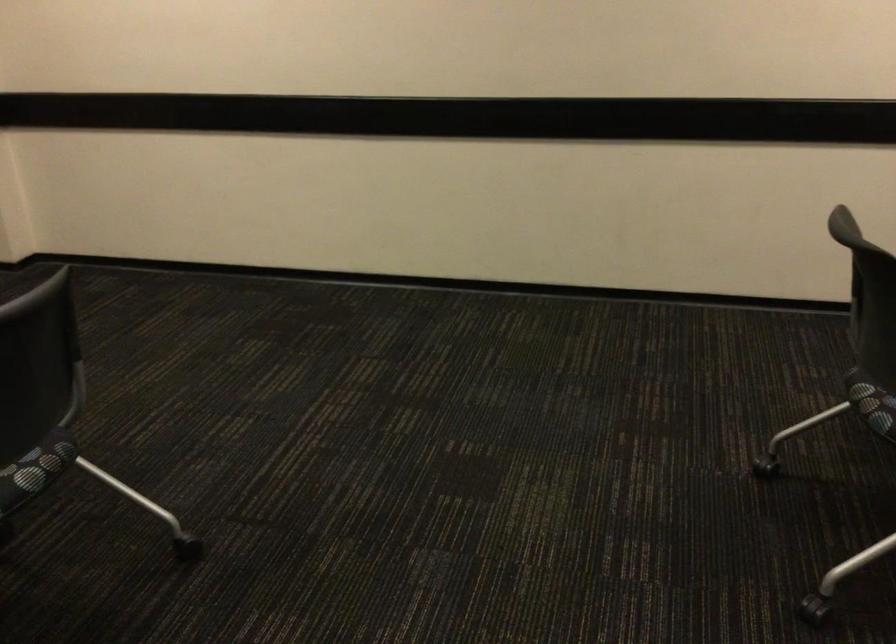
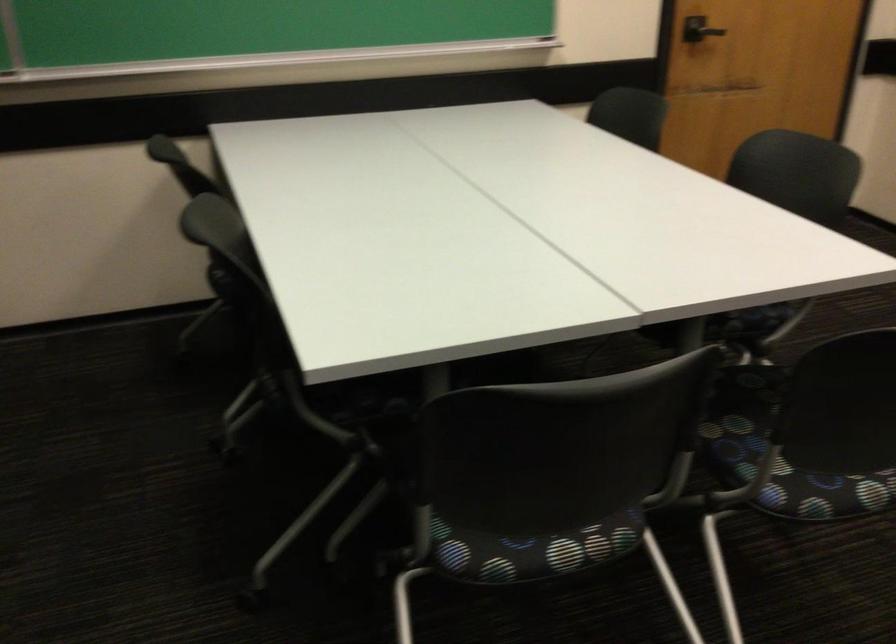
Question: Based on the continuous images, in which direction is the camera rotating? Reply with the corresponding letter.

Choices:
 (A) Left
 (B) Right
 (C) Up
 (D) Down

Answer: (A)